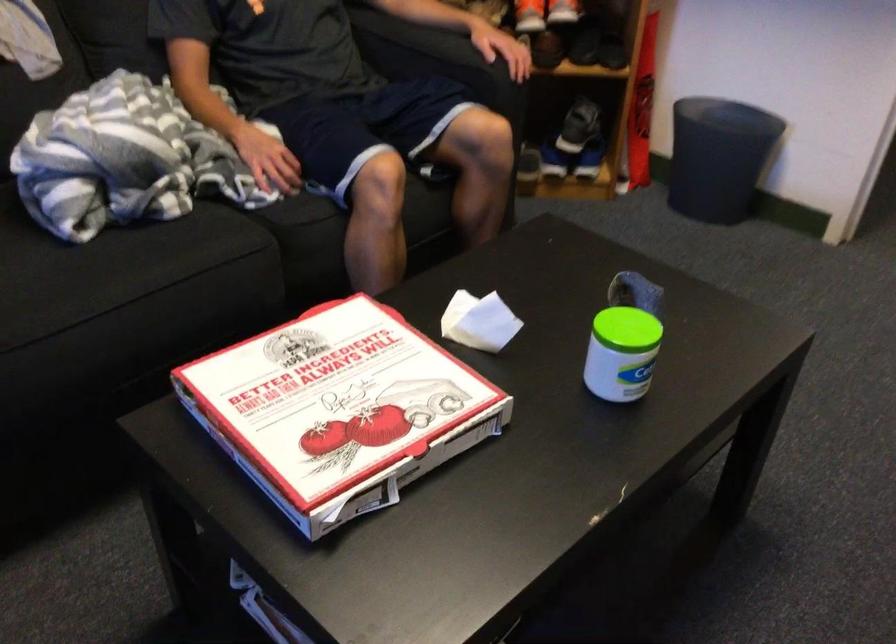
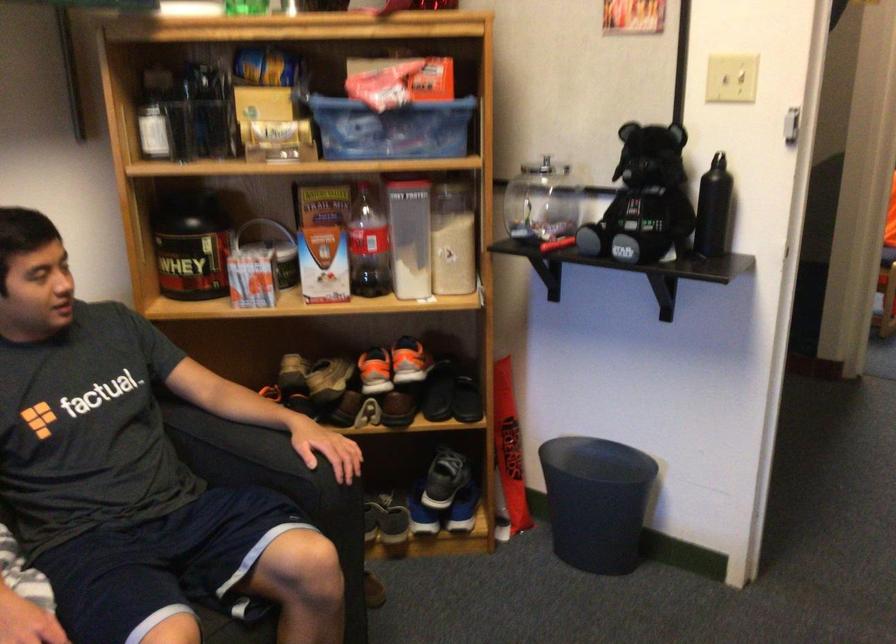
Where in the second image is the point corresponding to (x=725, y=120) from the first image?

(597, 460)